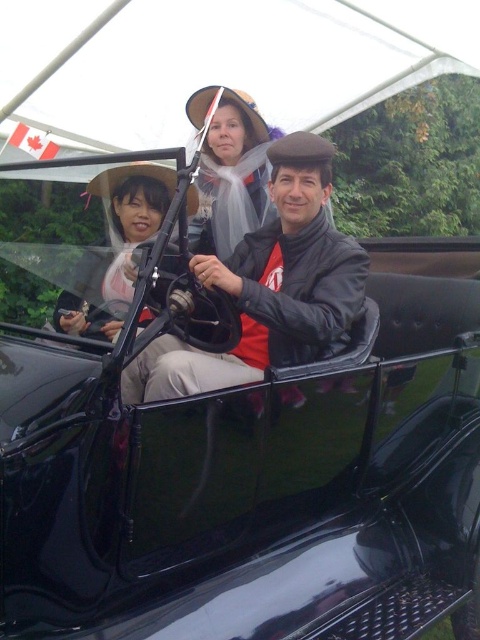
Is matte black jacket at center wider than matte white veil at center?

Indeed, matte black jacket at center has a greater width compared to matte white veil at center.

Looking at this image, does matte black jacket at center have a smaller size compared to matte white veil at center?

No.

Who is more distant from viewer, (297, 218) or (187, 106)?

The point (187, 106) is more distant.

This screenshot has width=480, height=640. I want to click on matte black jacket at center, so click(269, 288).

Which is below, white fabric canopy at upper center or matte black car at left?

matte black car at left is lower down.

Can you confirm if white fabric canopy at upper center is positioned to the right of matte black car at left?

Indeed, white fabric canopy at upper center is positioned on the right side of matte black car at left.

Describe the element at coordinates (245, 64) in the screenshot. The width and height of the screenshot is (480, 640). I see `white fabric canopy at upper center` at that location.

Locate an element on the screen. white fabric canopy at upper center is located at coordinates (245, 64).

Does white fabric canopy at upper center appear under matte white veil at center?

Incorrect, white fabric canopy at upper center is not positioned below matte white veil at center.

Who is more forward, (410, 45) or (250, 170)?

Point (250, 170)

Find the location of a particular element. This screenshot has width=480, height=640. white fabric canopy at upper center is located at coordinates (245, 64).